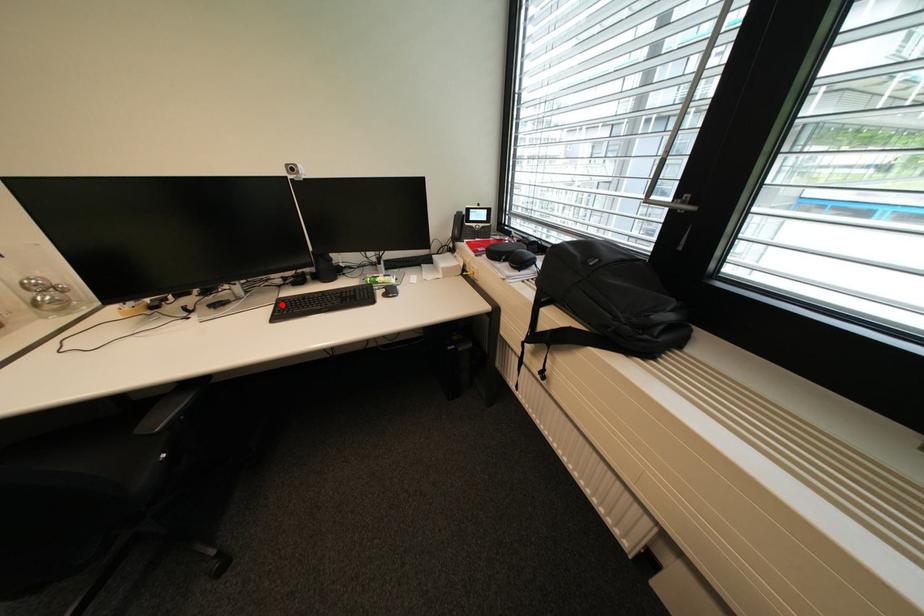
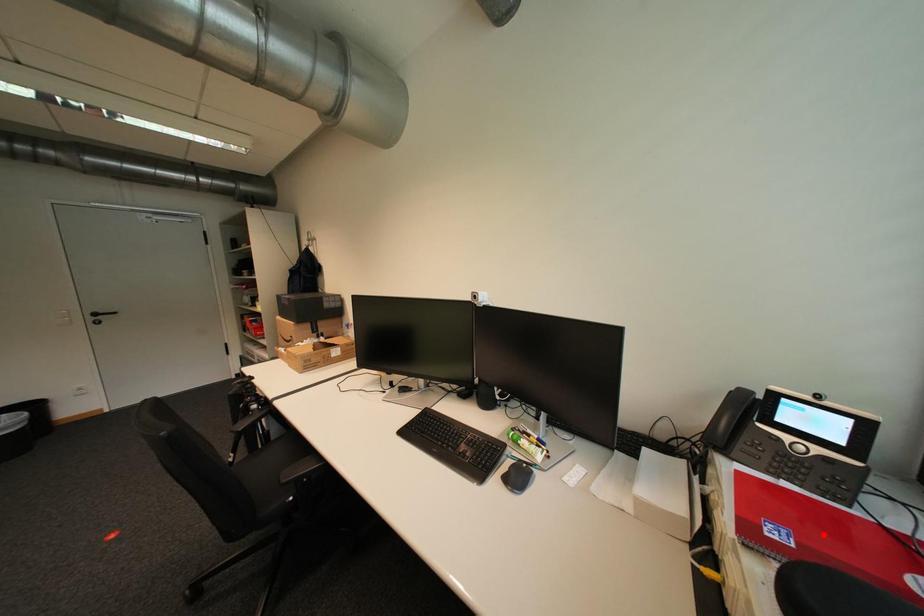
I am providing you with two images of the same scene from different viewpoints. A red point is marked on the first image and another point is marked on the second image. Is the marked point in image1 the same physical position as the marked point in image2?

No